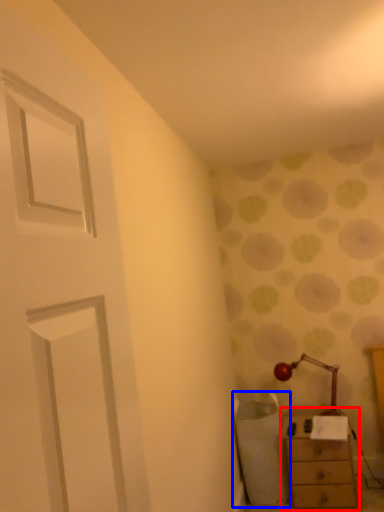
Question: Which object is closer to the camera taking this photo, chest of drawers (highlighted by a red box) or swivel chair (highlighted by a blue box)?

Choices:
 (A) chest of drawers
 (B) swivel chair

Answer: (A)